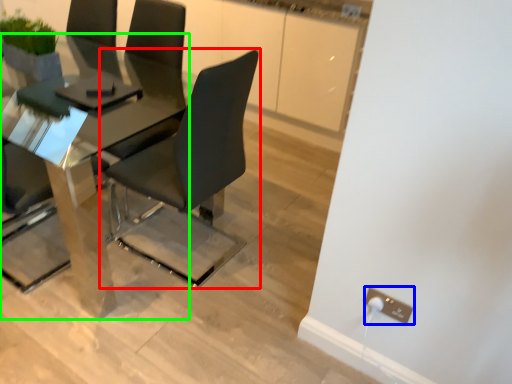
Question: Which object is the closest to the chair (highlighted by a red box)? Choose among these: electric outlet (highlighted by a blue box) or table (highlighted by a green box).

Choices:
 (A) electric outlet
 (B) table

Answer: (B)